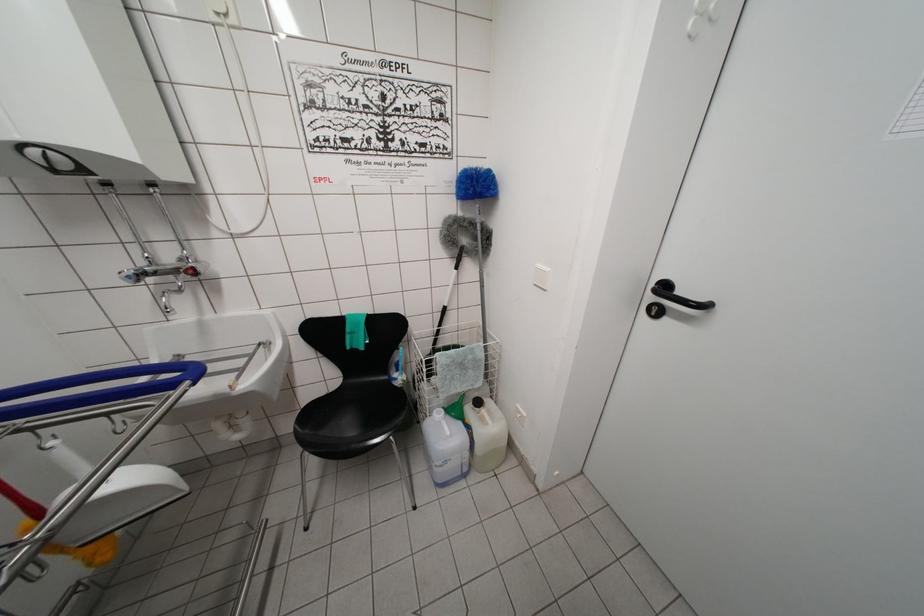
Identify the location of blue faucet knob. The image size is (924, 616). (128, 276).